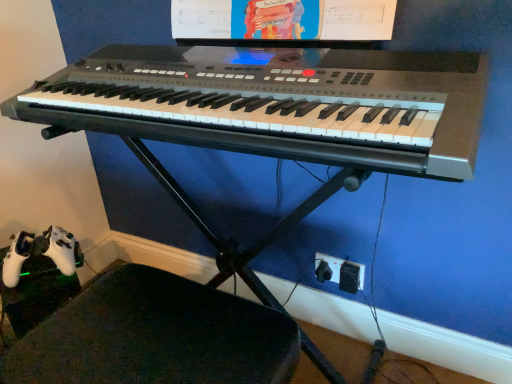
In order to face black leather swivel chair at lower left, should I rotate leftwards or rightwards?

Turn left by 12.193 degrees to look at black leather swivel chair at lower left.

Image resolution: width=512 pixels, height=384 pixels. What do you see at coordinates (339, 272) in the screenshot?
I see `black plastic plug at lower right` at bounding box center [339, 272].

Find the location of `black plastic keyboard at center`. black plastic keyboard at center is located at coordinates (278, 103).

At what (x,y) coordinates should I click in order to perform the action: click on black leather swivel chair at lower left. Please return your answer as a coordinate pair (x, y). This screenshot has height=384, width=512. Looking at the image, I should click on (155, 336).

Which of these two, black plastic keyboard at center or black leather swivel chair at lower left, is bigger?

black leather swivel chair at lower left.

Is black plastic keyboard at center touching black leather swivel chair at lower left?

No, black plastic keyboard at center is not in contact with black leather swivel chair at lower left.

From a real-world perspective, is black plastic keyboard at center physically above black leather swivel chair at lower left?

Yes, from a real-world perspective, black plastic keyboard at center is over black leather swivel chair at lower left

Identify the location of computer monitor that appears on the right of black leather swivel chair at lower left. (282, 21).

Is matte plastic computer monitor at upper center aimed at black leather swivel chair at lower left?

No, matte plastic computer monitor at upper center is not turned towards black leather swivel chair at lower left.

Is matte plastic computer monitor at upper center touching black leather swivel chair at lower left?

No, matte plastic computer monitor at upper center is not with black leather swivel chair at lower left.

Can you confirm if matte plastic computer monitor at upper center is positioned to the right of black leather swivel chair at lower left?

Yes, matte plastic computer monitor at upper center is to the right of black leather swivel chair at lower left.

Based on the photo, is black plastic plug at lower right aimed at matte plastic computer monitor at upper center?

No, black plastic plug at lower right is not aimed at matte plastic computer monitor at upper center.

From a real-world perspective, is black plastic plug at lower right below matte plastic computer monitor at upper center?

Yes, from a real-world perspective, black plastic plug at lower right is beneath matte plastic computer monitor at upper center.

Can you confirm if black plastic plug at lower right is shorter than matte plastic computer monitor at upper center?

No.

Can you confirm if black plastic plug at lower right is bigger than matte plastic computer monitor at upper center?

No.

Is matte plastic computer monitor at upper center to the left or to the right of black plastic keyboard at center in the image?

In the image, matte plastic computer monitor at upper center appears on the right side of black plastic keyboard at center.

Considering the sizes of objects matte plastic computer monitor at upper center and black plastic keyboard at center in the image provided, who is bigger, matte plastic computer monitor at upper center or black plastic keyboard at center?

Bigger between the two is black plastic keyboard at center.

Considering the sizes of objects matte plastic computer monitor at upper center and black plastic keyboard at center in the image provided, who is wider, matte plastic computer monitor at upper center or black plastic keyboard at center?

Wider between the two is black plastic keyboard at center.

Would you say black plastic keyboard at center is part of matte plastic computer monitor at upper center's contents?

Actually, black plastic keyboard at center is outside matte plastic computer monitor at upper center.

Based on the photo, considering the relative positions of black plastic keyboard at center and matte plastic computer monitor at upper center in the image provided, is black plastic keyboard at center behind matte plastic computer monitor at upper center?

That is False.

Is black plastic keyboard at center positioned with its back to matte plastic computer monitor at upper center?

No, black plastic keyboard at center is not facing away from matte plastic computer monitor at upper center.

From the image's perspective, which one is positioned higher, black plastic keyboard at center or matte plastic computer monitor at upper center?

matte plastic computer monitor at upper center.

Where is `plug on the right of black plastic keyboard at center`? plug on the right of black plastic keyboard at center is located at coordinates (339, 272).

In the scene shown: Considering the sizes of objects black plastic plug at lower right and black plastic keyboard at center in the image provided, who is bigger, black plastic plug at lower right or black plastic keyboard at center?

With larger size is black plastic keyboard at center.

Which is behind, point (337, 267) or point (417, 145)?

Positioned behind is point (337, 267).

From a real-world perspective, relative to black plastic keyboard at center, is black plastic plug at lower right vertically above or below?

black plastic plug at lower right is situated lower than black plastic keyboard at center in the real world.

Identify the location of swivel chair below the black plastic plug at lower right (from the image's perspective). This screenshot has width=512, height=384. (155, 336).

Is point (201, 321) less distant than point (333, 271)?

Yes, it is in front of point (333, 271).

Can you confirm if black leather swivel chair at lower left is thinner than black plastic plug at lower right?

No, black leather swivel chair at lower left is not thinner than black plastic plug at lower right.

Considering the sizes of objects black leather swivel chair at lower left and black plastic plug at lower right in the image provided, who is smaller, black leather swivel chair at lower left or black plastic plug at lower right?

black plastic plug at lower right is smaller.

The width and height of the screenshot is (512, 384). What are the coordinates of `musical keyboard that appears behind the black leather swivel chair at lower left` in the screenshot? It's located at (278, 103).

Image resolution: width=512 pixels, height=384 pixels. Identify the location of computer monitor above the black leather swivel chair at lower left (from the image's perspective). (282, 21).

Based on the photo, based on their spatial positions, is black leather swivel chair at lower left or black plastic plug at lower right closer to matte plastic computer monitor at upper center?

Among the two, black leather swivel chair at lower left is located nearer to matte plastic computer monitor at upper center.

From the image, which object appears to be farther from matte plastic computer monitor at upper center, black plastic plug at lower right or black leather swivel chair at lower left?

black plastic plug at lower right is further to matte plastic computer monitor at upper center.

Looking at the image, which one is located closer to black plastic plug at lower right, black leather swivel chair at lower left or black plastic keyboard at center?

Among the two, black leather swivel chair at lower left is located nearer to black plastic plug at lower right.

Looking at the image, which one is located closer to black leather swivel chair at lower left, black plastic plug at lower right or black plastic keyboard at center?

Based on the image, black plastic keyboard at center appears to be nearer to black leather swivel chair at lower left.

When comparing their distances from black plastic plug at lower right, does matte plastic computer monitor at upper center or black plastic keyboard at center seem further?

The object further to black plastic plug at lower right is matte plastic computer monitor at upper center.

From the image, which object appears to be nearer to black plastic keyboard at center, black leather swivel chair at lower left or black plastic plug at lower right?

Among the two, black leather swivel chair at lower left is located nearer to black plastic keyboard at center.

When comparing their distances from black plastic keyboard at center, does matte plastic computer monitor at upper center or black plastic plug at lower right seem further?

black plastic plug at lower right is positioned further to the anchor black plastic keyboard at center.

Based on their spatial positions, is black leather swivel chair at lower left or matte plastic computer monitor at upper center further from black plastic keyboard at center?

black leather swivel chair at lower left.

At what (x,y) coordinates should I click in order to perform the action: click on plug that lies between matte plastic computer monitor at upper center and black leather swivel chair at lower left from top to bottom. Please return your answer as a coordinate pair (x, y). Looking at the image, I should click on (339, 272).

Identify the location of musical keyboard located between black leather swivel chair at lower left and black plastic plug at lower right in the depth direction. (278, 103).

I want to click on musical keyboard between matte plastic computer monitor at upper center and black leather swivel chair at lower left vertically, so click(278, 103).

Identify the location of computer monitor located between black plastic keyboard at center and black plastic plug at lower right in the depth direction. The height and width of the screenshot is (384, 512). (282, 21).